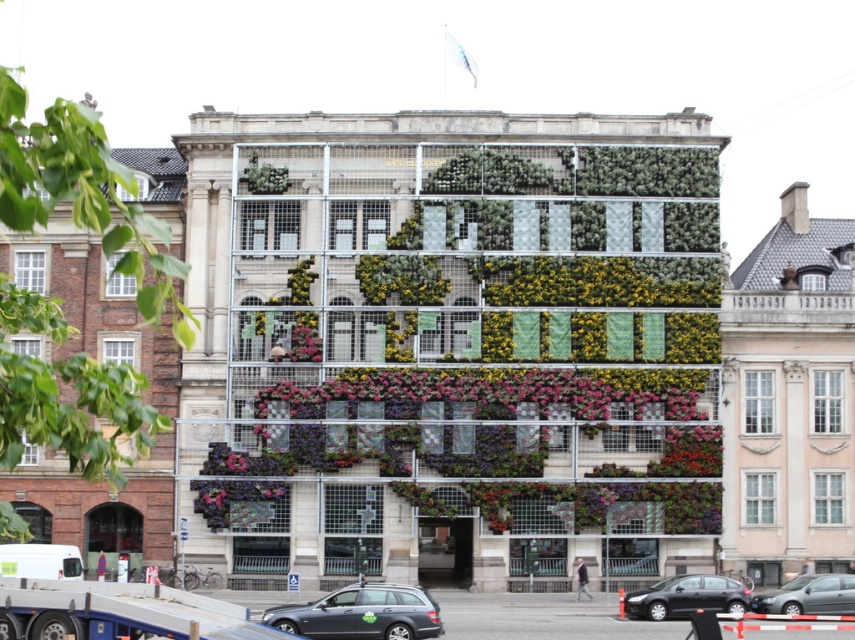
You are a delivery person who needs to park your vehicle in the parking lot adjacent to the multi story building. You have a delivery van that is 1.8 meters tall. The parking lot has two spaces available. One is next to the black glossy car at lower right and the other is next to the metallic silver sedan at center. Based on the height of the cars, which parking space would be safer to choose to avoid damaging your van?

The metallic silver sedan at center is shorter than the black glossy car at lower right. Since your van is 1.8 meters tall, parking next to the metallic silver sedan at center would be safer to avoid damaging your van, as the sedan is shorter and less likely to cause clearance issues.

Looking at this image, you are a delivery person approaching the building and need to park your vehicle. You see a matte gray station wagon at lower center and a metallic silver sedan at center. Which vehicle is parked closer to the entrance of the building?

The metallic silver sedan at center is parked closer to the entrance of the building because the matte gray station wagon at lower center is above it, indicating it is positioned higher up and farther from the entrance.

You are a pedestrian standing at the entrance of the building and want to cross the street to reach the park on the other side. There are two cars in your path. The matte gray station wagon at lower center and the metallic silver sedan at center. Which car should you wait behind to cross safely?

You should wait behind the metallic silver sedan at center because the matte gray station wagon at lower center is in front of it, meaning the sedan is further back and closer to the curb where you can safely cross.